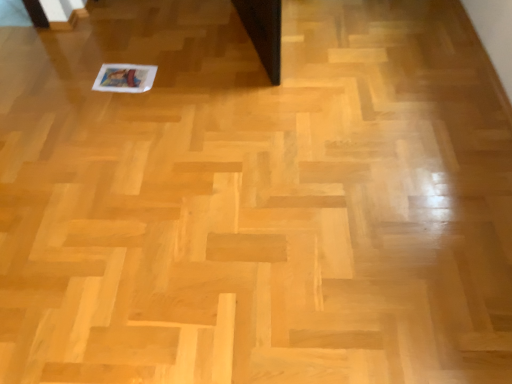
Where is `white glossy plate at upper center`? The width and height of the screenshot is (512, 384). white glossy plate at upper center is located at coordinates (125, 78).

Describe the element at coordinates (125, 78) in the screenshot. Image resolution: width=512 pixels, height=384 pixels. I see `white glossy plate at upper center` at that location.

This screenshot has width=512, height=384. Find the location of `white glossy plate at upper center`. white glossy plate at upper center is located at coordinates (125, 78).